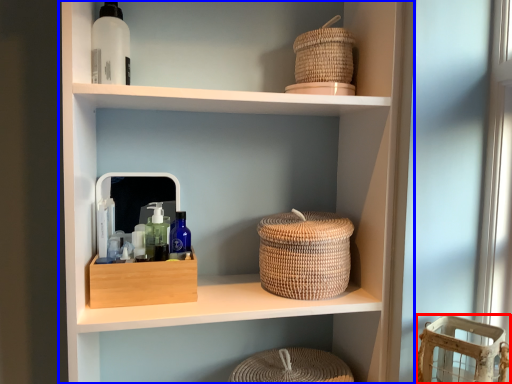
Question: Which object appears farthest to the camera in this image, basket (highlighted by a red box) or shelf (highlighted by a blue box)?

Choices:
 (A) basket
 (B) shelf

Answer: (B)